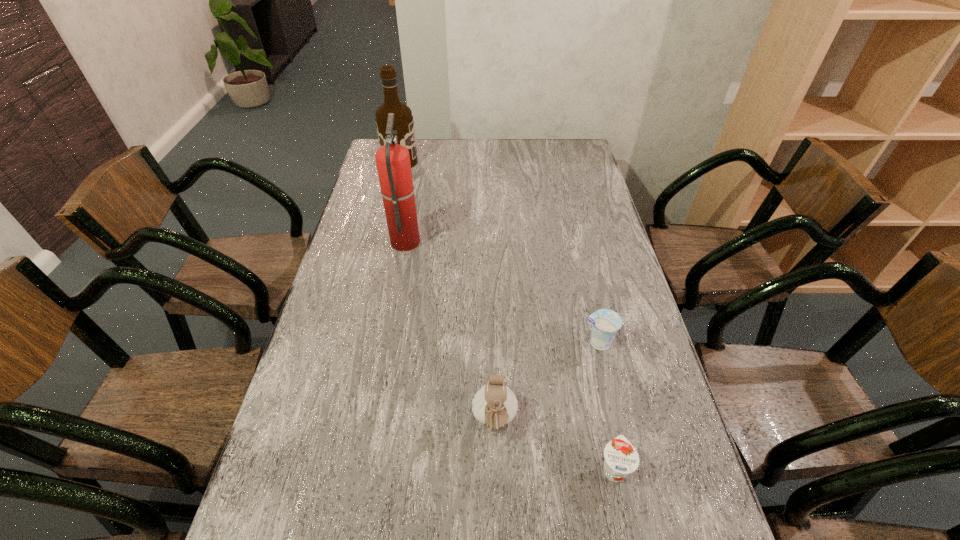
This screenshot has width=960, height=540. What are the coordinates of `fire extinguisher` in the screenshot? It's located at (393, 163).

At what (x,y) coordinates should I click in order to perform the action: click on alcohol. Please return your answer as a coordinate pair (x, y). Looking at the image, I should click on (403, 120).

Locate an element on the screen. the third shortest object is located at coordinates (495, 405).

Image resolution: width=960 pixels, height=540 pixels. Identify the location of the second nearest object. (495, 405).

At what (x,y) coordinates should I click in order to perform the action: click on the second shortest object. Please return your answer as a coordinate pair (x, y). Image resolution: width=960 pixels, height=540 pixels. Looking at the image, I should click on (606, 323).

You are a GUI agent. You are given a task and a screenshot of the screen. Output one action in this format:
    pyautogui.click(x=<x>, y=<y>)
    Task: Click on the third nearest object
    The width and height of the screenshot is (960, 540).
    Given the screenshot: What is the action you would take?
    pyautogui.click(x=606, y=323)

I want to click on the shorter yogurt, so click(x=621, y=458).

Find the location of `the nearer yogurt`. the nearer yogurt is located at coordinates (621, 458).

Identify the location of vacant space located with the nozzle and gauge on the fire extinguisher. (462, 241).

Find the location of `vacant point located on the label of the alcohol`. vacant point located on the label of the alcohol is located at coordinates (472, 162).